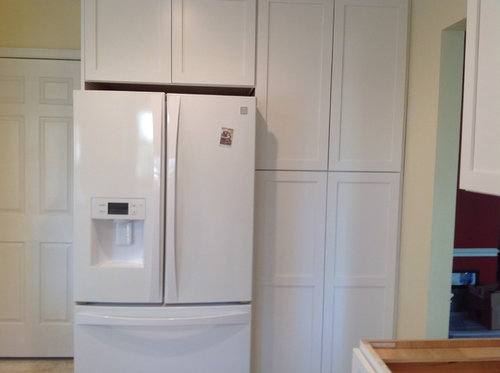
This screenshot has width=500, height=373. Identify the location of refrigerator. (191, 252).